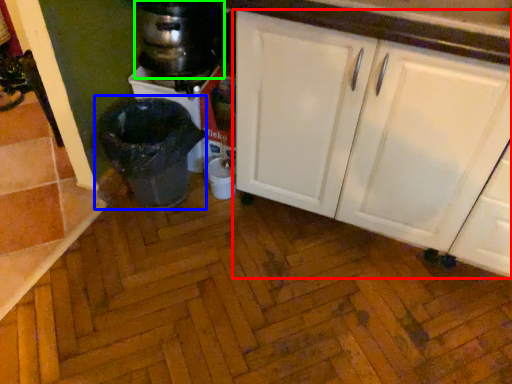
Question: Estimate the real-world distances between objects in this image. Which object is closer to cabinetry (highlighted by a red box), waste container (highlighted by a blue box) or appliance (highlighted by a green box)?

Choices:
 (A) waste container
 (B) appliance

Answer: (A)